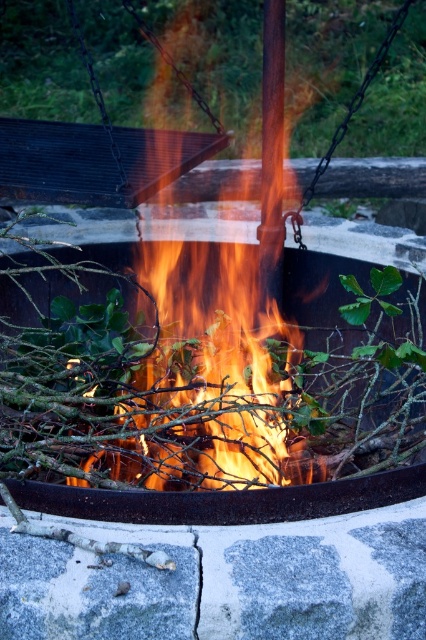
Does flamewoodenfire at center appear over flaming wood at center?

Actually, flamewoodenfire at center is below flaming wood at center.

Is point (149, 259) closer to viewer compared to point (379, 492)?

No, it is behind (379, 492).

Identify the location of flamewoodenfire at center. This screenshot has height=640, width=426. (233, 275).